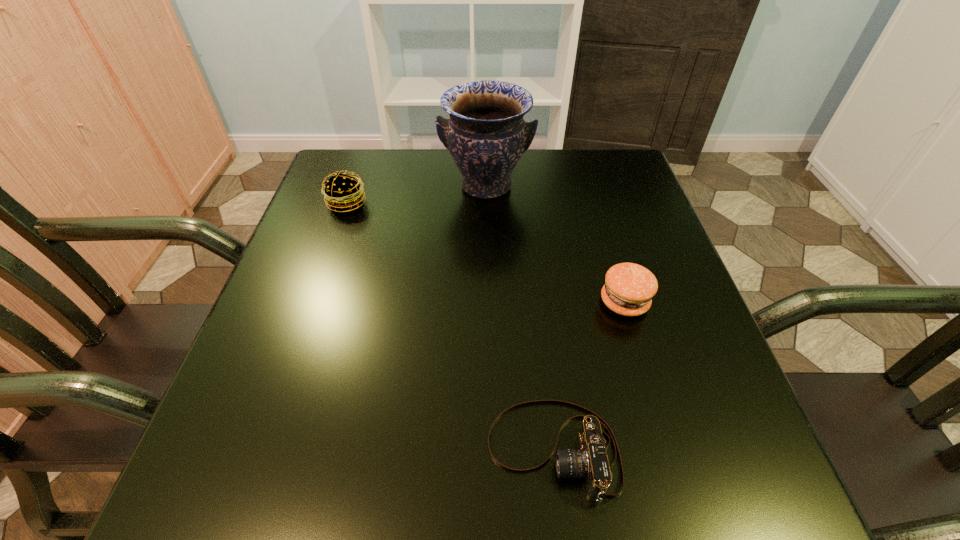
Identify the location of vacant space in between the camera and the rightmost object. (588, 376).

You are a GUI agent. You are given a task and a screenshot of the screen. Output one action in this format:
    pyautogui.click(x=<x>, y=<y>)
    Task: Click on the vacant area between the tallest object and the left patty
    This screenshot has width=960, height=540.
    Given the screenshot: What is the action you would take?
    pyautogui.click(x=417, y=194)

Find the location of `blank region between the rightmost object and the shortest object`. blank region between the rightmost object and the shortest object is located at coordinates (588, 376).

This screenshot has height=540, width=960. I want to click on free space between the leftmost object and the third farthest object, so click(x=486, y=253).

I want to click on unoccupied position between the tallest object and the shortest object, so click(519, 319).

Identify the location of vacant region between the third farthest object and the farther patty. (486, 253).

Identify the location of object that is the nearest to the farther patty. (486, 135).

Select which object is the third closest to the camera. Please provide its 2D coordinates. Your answer should be formatted as a tuple, i.e. [(x, y)], where the tuple contains the x and y coordinates of a point satisfying the conditions above.

[(343, 192)]

I want to click on vacant area in the image that satisfies the following two spatial constraints: 1. on the front handle of the pottery; 2. on the left side of the rightmost object, so click(488, 302).

Where is `free spot that satisfies the following two spatial constraints: 1. on the front handle of the right patty; 2. on the left side of the pottery`? Image resolution: width=960 pixels, height=540 pixels. free spot that satisfies the following two spatial constraints: 1. on the front handle of the right patty; 2. on the left side of the pottery is located at coordinates (488, 302).